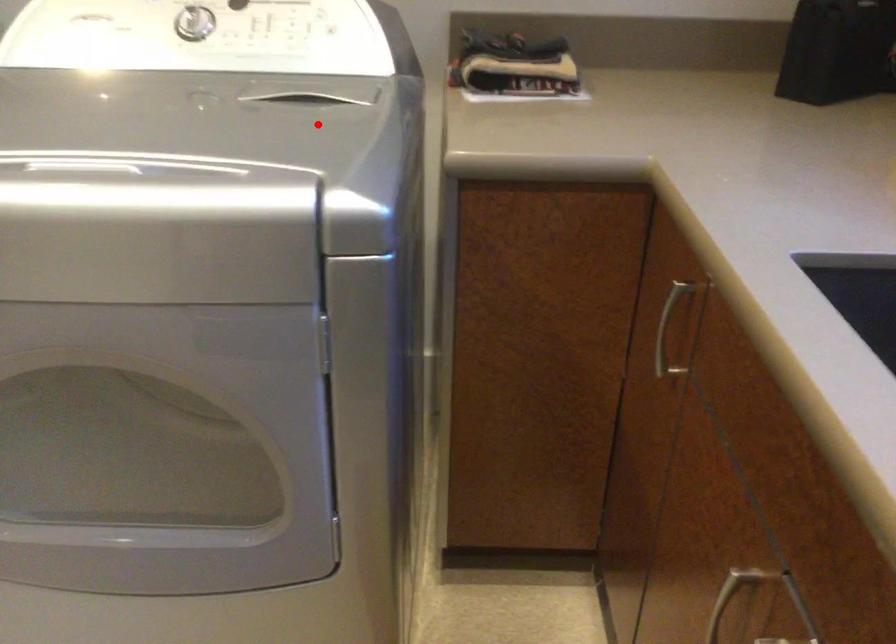
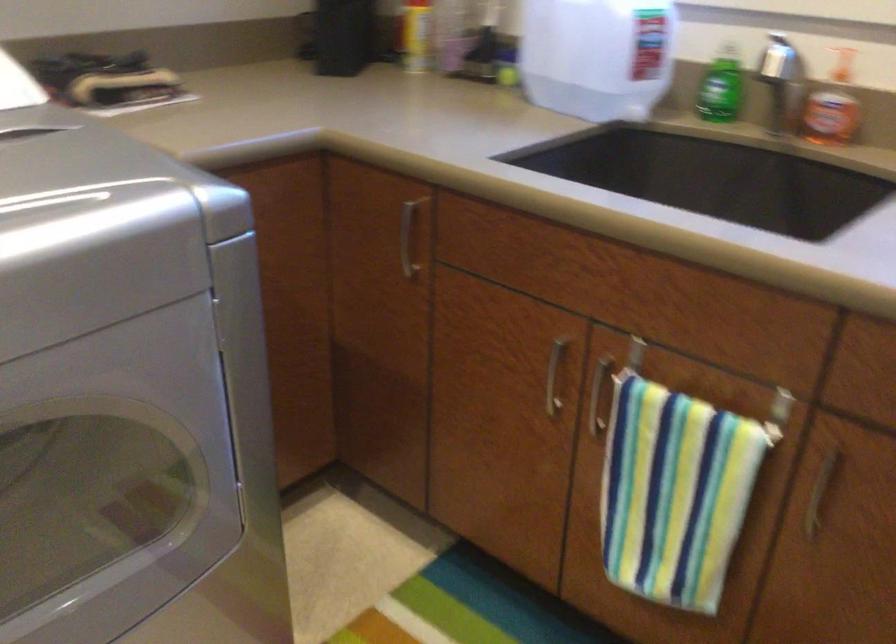
Locate, in the second image, the point that corresponds to the highlighted location in the first image.

(73, 155)